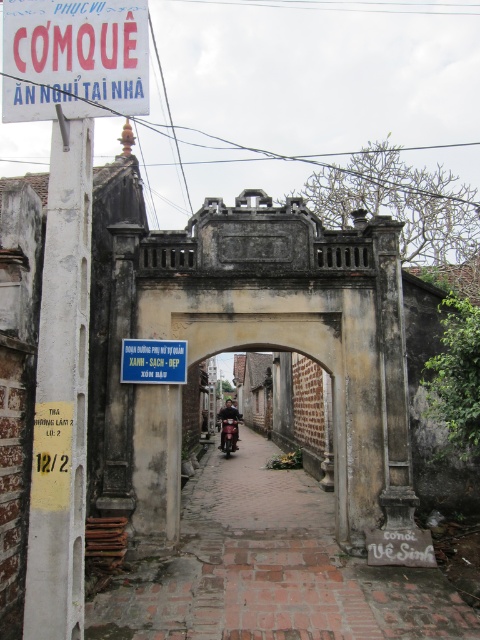
Question: Is red plastic sign at upper left above metallic red motorbike at center?

Choices:
 (A) no
 (B) yes

Answer: (B)

Question: Is red plastic sign at upper left bigger than metallic red motorbike at center?

Choices:
 (A) no
 (B) yes

Answer: (A)

Question: From the image, what is the correct spatial relationship of red plastic sign at upper left in relation to metallic red motorbike at center?

Choices:
 (A) below
 (B) above

Answer: (B)

Question: Which of the following is the closest to the observer?

Choices:
 (A) (130, 93)
 (B) (233, 442)

Answer: (A)